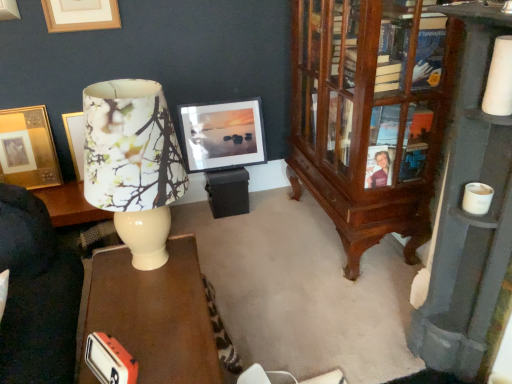
The width and height of the screenshot is (512, 384). In order to click on vacant space underneath floral paper lampshade at left (from a real-world perspective) in this screenshot , I will do `click(150, 270)`.